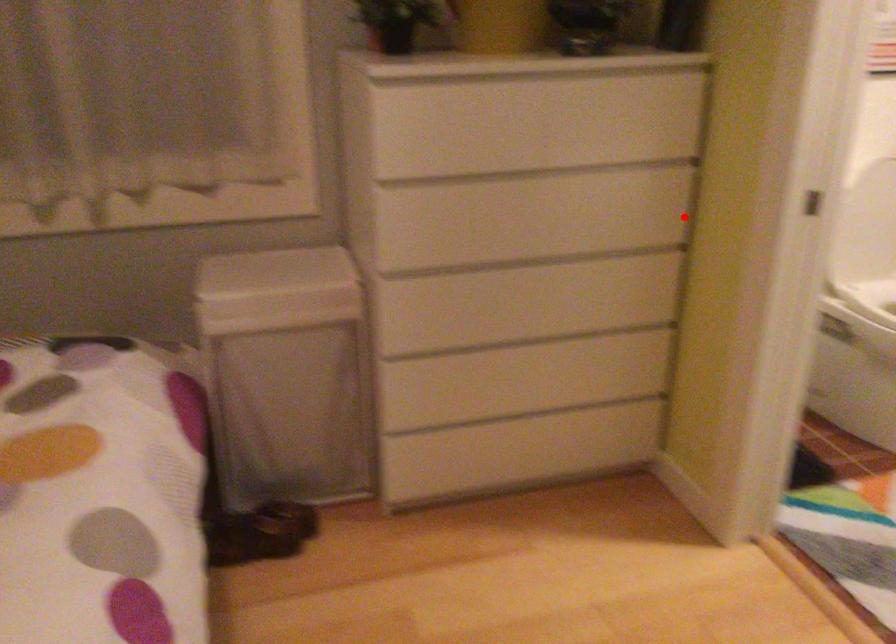
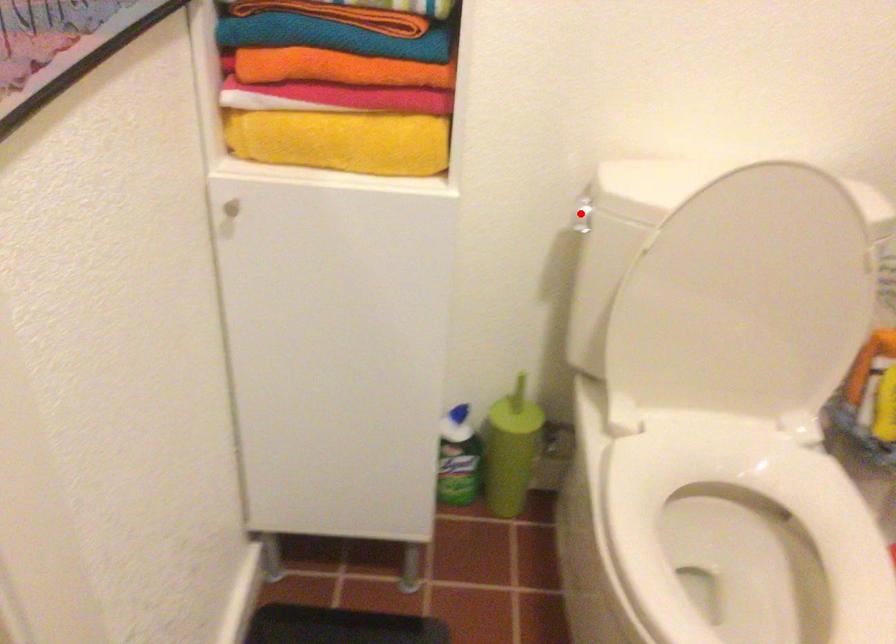
I am providing you with two images of the same scene from different viewpoints. A red point is marked on the first image and another point is marked on the second image. Are the points marked in image1 and image2 representing the same 3D position?

No